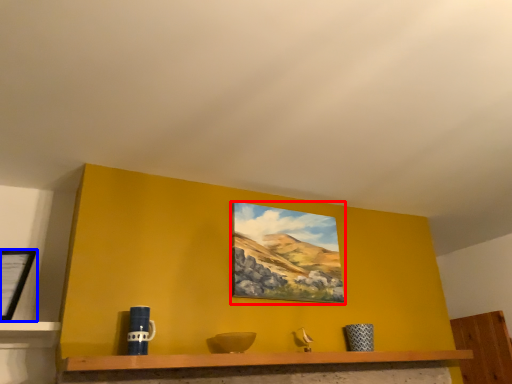
Question: Which object appears farthest to the camera in this image, picture frame (highlighted by a red box) or picture frame (highlighted by a blue box)?

Choices:
 (A) picture frame
 (B) picture frame

Answer: (A)